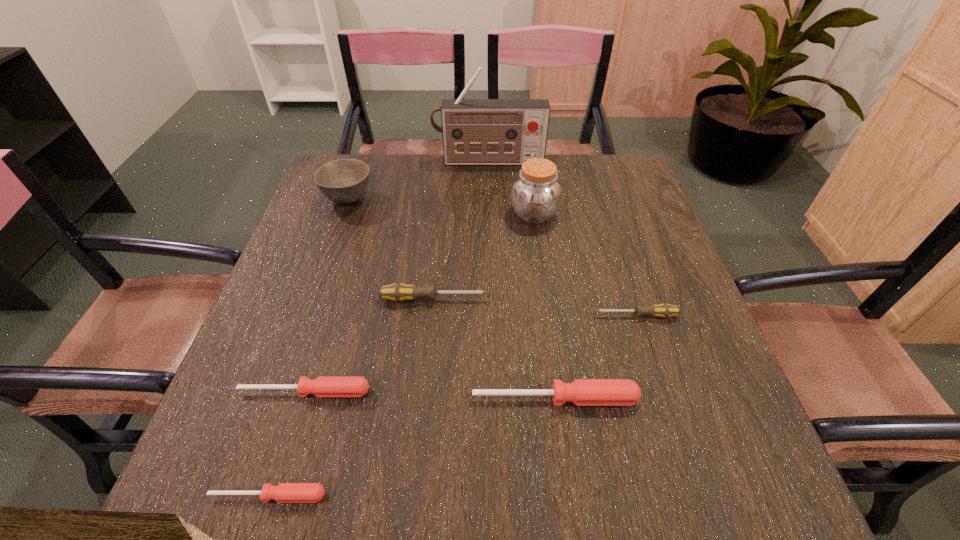
I want to click on the nearer gray screwdriver, so click(x=663, y=310).

At what (x,y) coordinates should I click in order to perform the action: click on the nearest red screwdriver. Please return your answer as a coordinate pair (x, y). Looking at the image, I should click on (284, 492).

This screenshot has width=960, height=540. Identify the location of the shortest object. (284, 492).

I want to click on vacant region located 0.150m on the front panel of the farthest object, so click(490, 197).

Where is `vacant position located 0.210m on the front of the brown jar`? This screenshot has width=960, height=540. vacant position located 0.210m on the front of the brown jar is located at coordinates (544, 291).

The height and width of the screenshot is (540, 960). I want to click on blank space located 0.260m on the front of the bowl, so click(318, 286).

At what (x,y) coordinates should I click in order to perform the action: click on free space located at the tip of the bigger gray screwdriver. Please return your answer as a coordinate pair (x, y). The width and height of the screenshot is (960, 540). Looking at the image, I should click on (630, 299).

This screenshot has height=540, width=960. I want to click on free space located on the left of the rightmost red screwdriver, so click(x=363, y=399).

Locate an element on the screen. Image resolution: width=960 pixels, height=540 pixels. vacant position located on the right of the second smallest red screwdriver is located at coordinates (485, 392).

Where is `vacant space positioned 0.190m at the tip of the fourth nearest object`? vacant space positioned 0.190m at the tip of the fourth nearest object is located at coordinates (504, 315).